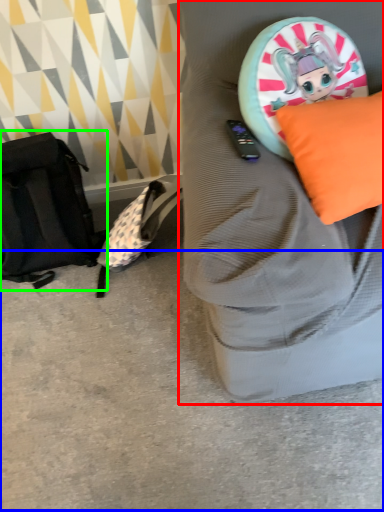
Question: Which object is positioned farthest from furniture (highlighted by a red box)? Select from concrete (highlighted by a blue box) and messenger bag (highlighted by a green box).

Choices:
 (A) concrete
 (B) messenger bag

Answer: (B)